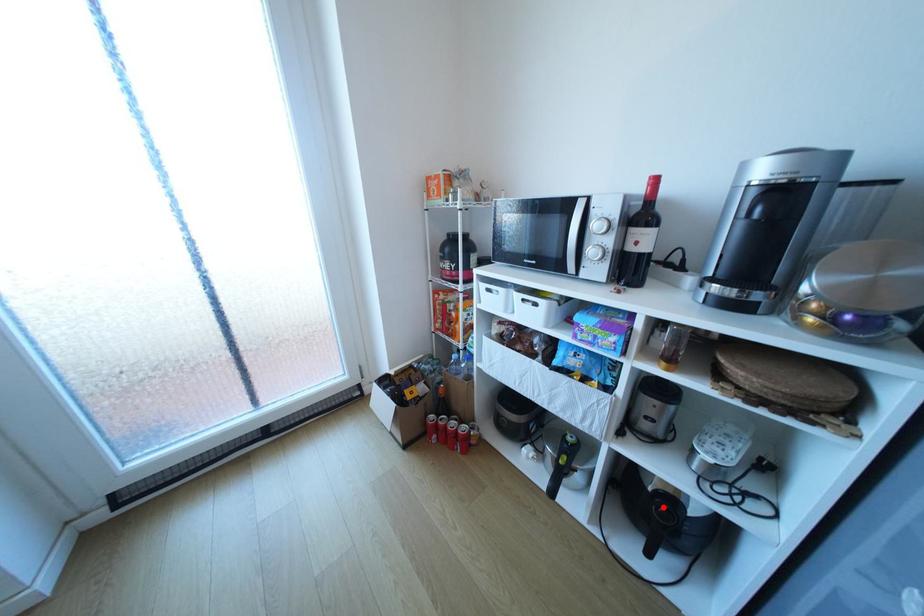
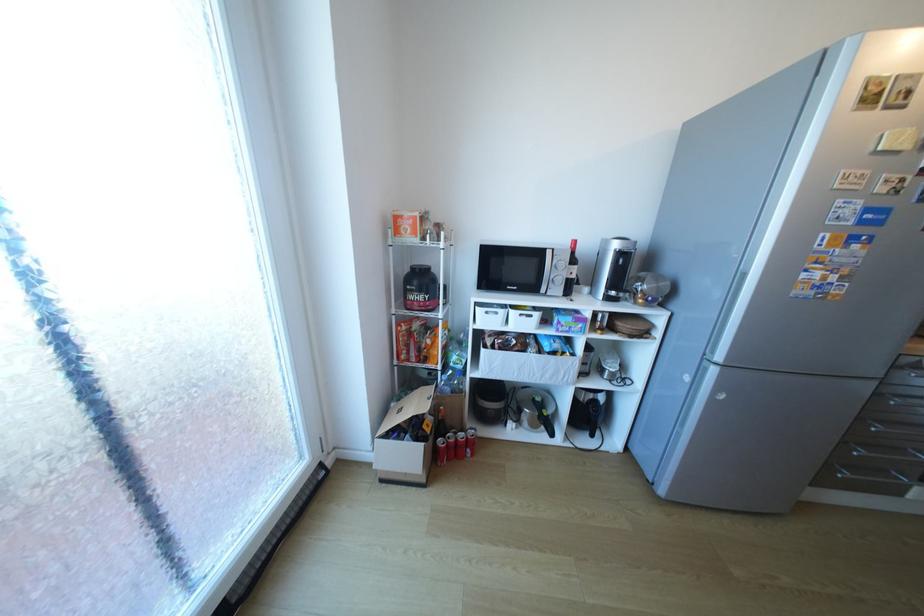
Where in the second image is the point corresponding to the highlighted location from the first image?

(600, 408)